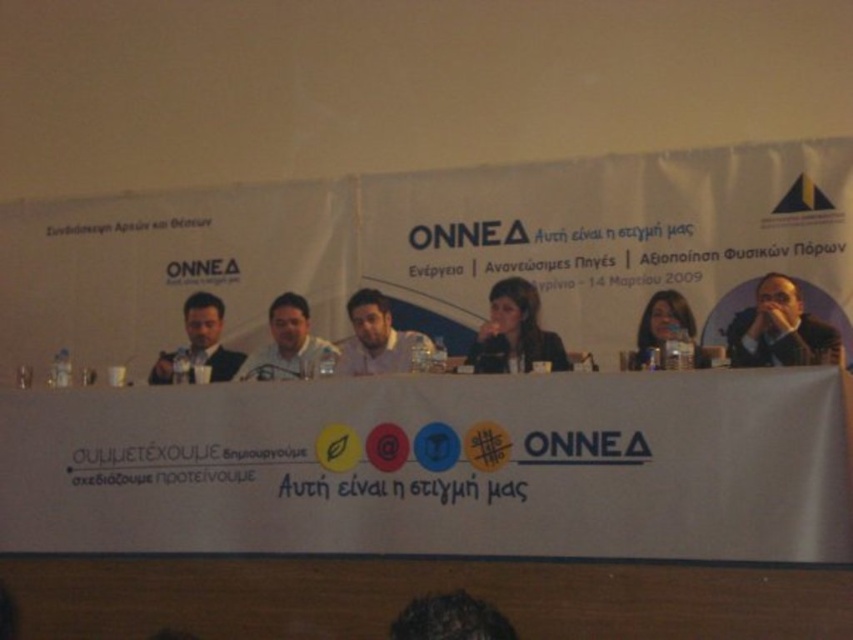
You are a photographer taking a portrait of the speaker at the conference. The speaker has dark brown hair at center and is holding a matte black microphone at center. To ensure the microphone is clearly visible, where should you position the microphone relative to the speaker?

The matte black microphone at center should be placed on the right side of the dark brown hair at center to ensure it is clearly visible.

You are a photographer at the event and want to capture a clear photo of the matte black laptop at center and the matte black hair at center. Which object is closer to the camera, and thus more in focus if you focus on the closer one?

The matte black laptop at center is closer to the camera than the matte black hair at center, so focusing on it will keep it in focus while the hair may be slightly out of focus.

You are a photographer standing at the camera position and need to capture a closeup shot of the dark brown suit at right. Given that your camera has a minimum focusing distance of 5 meters, will you be able to take the closeup without moving closer?

The dark brown suit at right is 4.87 meters away from the camera. Since the minimum focusing distance is 5 meters, the camera cannot focus closer than that. Therefore, you will not be able to take the closeup without moving further away or using a different lens.